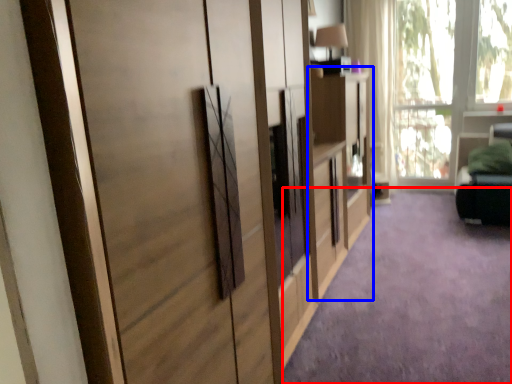
Question: Which point is closer to the camera, plain (highlighted by a red box) or dresser (highlighted by a blue box)?

Choices:
 (A) plain
 (B) dresser

Answer: (A)